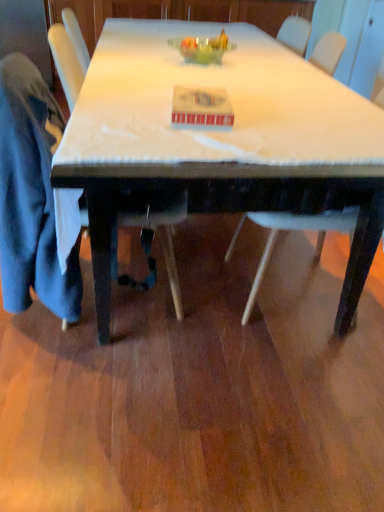
Question: Can you confirm if blue cotton robe at left is wider than translucent glass bowl at center?

Choices:
 (A) no
 (B) yes

Answer: (B)

Question: Can translucent glass bowl at center be found inside blue cotton robe at left?

Choices:
 (A) yes
 (B) no

Answer: (B)

Question: Is blue cotton robe at left positioned before translucent glass bowl at center?

Choices:
 (A) yes
 (B) no

Answer: (A)

Question: Does blue cotton robe at left turn towards translucent glass bowl at center?

Choices:
 (A) yes
 (B) no

Answer: (B)

Question: Would you consider blue cotton robe at left to be distant from translucent glass bowl at center?

Choices:
 (A) yes
 (B) no

Answer: (B)

Question: Choose the correct answer: Is white plastic chair at lower right, arranged as the 2th chair when viewed from the left, inside blue cotton robe at left or outside it?

Choices:
 (A) inside
 (B) outside

Answer: (B)

Question: In the image, is white plastic chair at lower right, positioned as the 1th chair in right-to-left order, positioned in front of or behind blue cotton robe at left?

Choices:
 (A) behind
 (B) front

Answer: (A)

Question: Considering the positions of white plastic chair at lower right, arranged as the 2th chair when viewed from the left, and blue cotton robe at left in the image, is white plastic chair at lower right, arranged as the 2th chair when viewed from the left, taller or shorter than blue cotton robe at left?

Choices:
 (A) short
 (B) tall

Answer: (B)

Question: Does point (334, 218) appear closer or farther from the camera than point (21, 205)?

Choices:
 (A) farther
 (B) closer

Answer: (A)

Question: Considering the positions of translucent glass bowl at center and blue cotton robe at left in the image, is translucent glass bowl at center taller or shorter than blue cotton robe at left?

Choices:
 (A) tall
 (B) short

Answer: (B)

Question: Is translucent glass bowl at center inside the boundaries of blue cotton robe at left, or outside?

Choices:
 (A) outside
 (B) inside

Answer: (A)

Question: Considering the positions of translucent glass bowl at center and blue cotton robe at left in the image, is translucent glass bowl at center wider or thinner than blue cotton robe at left?

Choices:
 (A) wide
 (B) thin

Answer: (B)

Question: Relative to blue cotton robe at left, is translucent glass bowl at center in front or behind?

Choices:
 (A) behind
 (B) front

Answer: (A)

Question: From the image's perspective, is velvet blue jacket at left, arranged as the first chair when viewed from the left, located above or below white plastic chair at lower right, arranged as the 2th chair when viewed from the left?

Choices:
 (A) above
 (B) below

Answer: (B)

Question: In terms of height, does velvet blue jacket at left, the 2th chair from the right, look taller or shorter compared to white plastic chair at lower right, positioned as the 1th chair in right-to-left order?

Choices:
 (A) short
 (B) tall

Answer: (B)